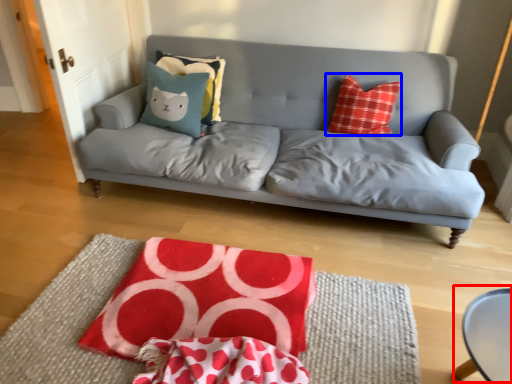
Question: Among these objects, which one is nearest to the camera, round table (highlighted by a red box) or throw pillow (highlighted by a blue box)?

Choices:
 (A) round table
 (B) throw pillow

Answer: (A)